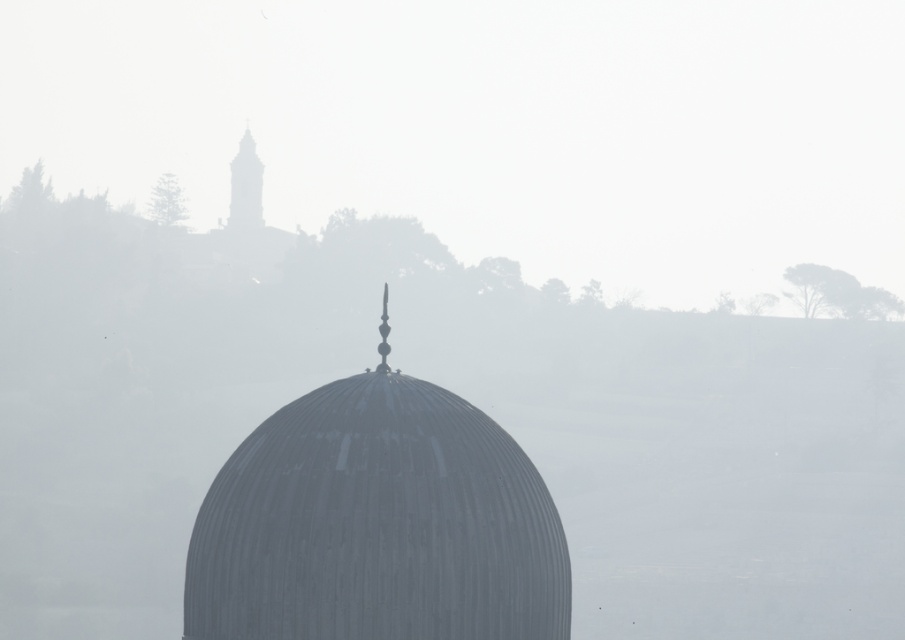
Is metallic dome at center closer to camera compared to smooth stone tower at upper left?

Yes, it is in front of smooth stone tower at upper left.

Is metallic dome at center behind smooth stone tower at upper left?

No, metallic dome at center is in front of smooth stone tower at upper left.

Locate an element on the screen. metallic dome at center is located at coordinates (377, 524).

Find the location of a particular element. This screenshot has height=640, width=905. metallic dome at center is located at coordinates pos(377,524).